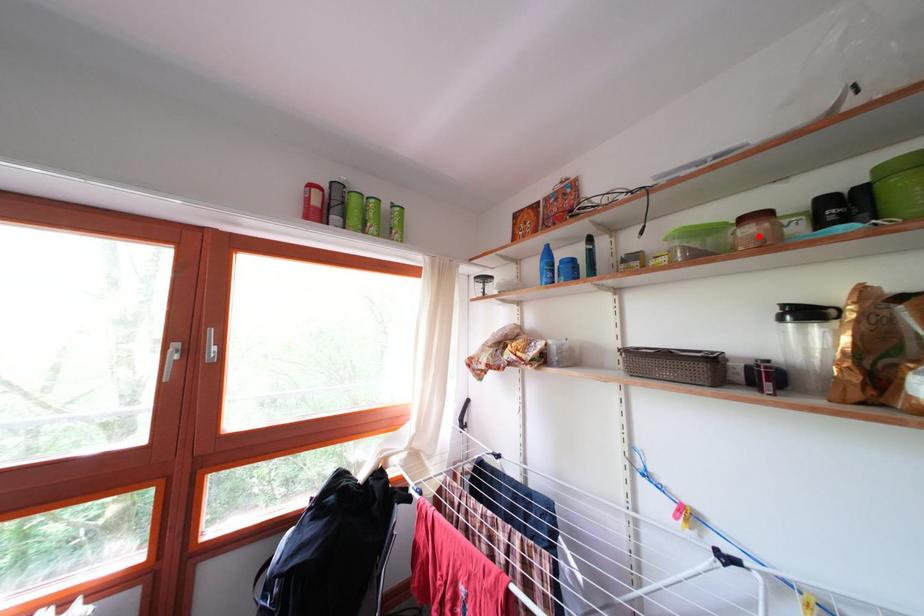
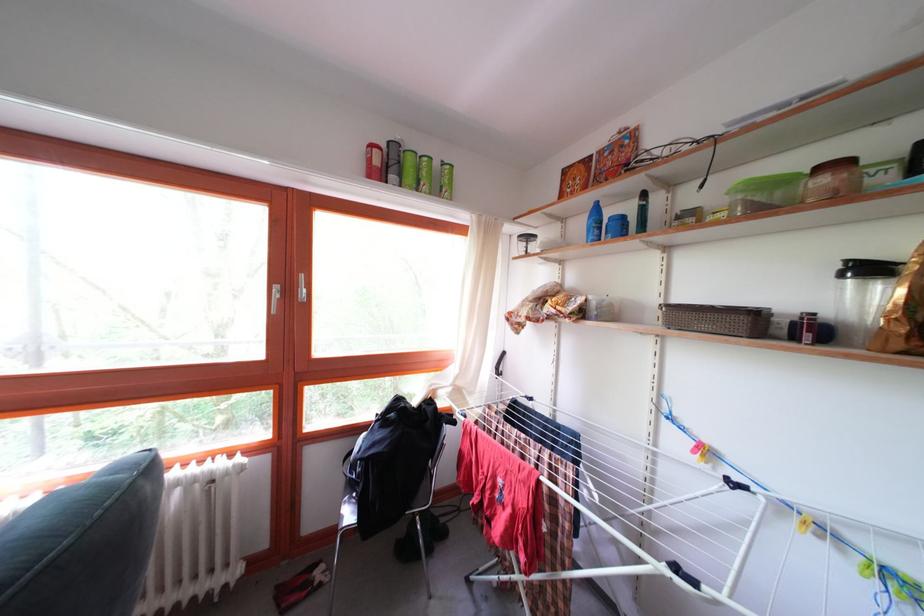
Where in the second image is the point corresponding to the highlighted location from the first image?

(832, 187)